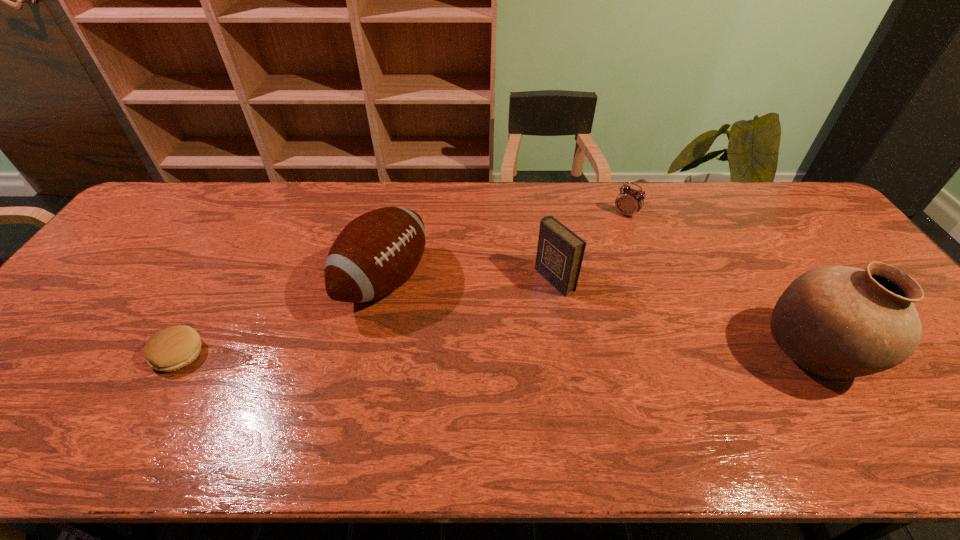
You are a GUI agent. You are given a task and a screenshot of the screen. Output one action in this format:
    pyautogui.click(x=<x>, y=<y>)
    Task: Click on the empty space that is in between the second object from left to right and the third tallest object
    
    Given the screenshot: What is the action you would take?
    pyautogui.click(x=469, y=280)

You are a GUI agent. You are given a task and a screenshot of the screen. Output one action in this format:
    pyautogui.click(x=<x>, y=<y>)
    Task: Click on the vacant area that lies between the football and the rightmost object
    
    Given the screenshot: What is the action you would take?
    pyautogui.click(x=598, y=318)

The width and height of the screenshot is (960, 540). I want to click on vacant space that's between the fourth tallest object and the rightmost object, so click(x=719, y=284).

The width and height of the screenshot is (960, 540). I want to click on empty space between the second object from right to left and the tallest object, so click(719, 284).

Where is `unoccupied position between the tallest object and the second object from right to left`? Image resolution: width=960 pixels, height=540 pixels. unoccupied position between the tallest object and the second object from right to left is located at coordinates (719, 284).

At what (x,y) coordinates should I click in order to perform the action: click on free space that is in between the fourth shortest object and the farthest object. Please return your answer as a coordinate pair (x, y). Image resolution: width=960 pixels, height=540 pixels. Looking at the image, I should click on (505, 247).

Locate an element on the screen. Image resolution: width=960 pixels, height=540 pixels. free spot between the second tallest object and the third object from left to right is located at coordinates (469, 280).

Where is `free space between the second object from right to left and the third object from right to left`? This screenshot has width=960, height=540. free space between the second object from right to left and the third object from right to left is located at coordinates (590, 247).

Where is `free space that is in between the tallest object and the fourth object from left to right`? Image resolution: width=960 pixels, height=540 pixels. free space that is in between the tallest object and the fourth object from left to right is located at coordinates (719, 284).

This screenshot has width=960, height=540. What are the coordinates of `vacant space in between the second object from left to right and the tallest object` in the screenshot? It's located at (598, 318).